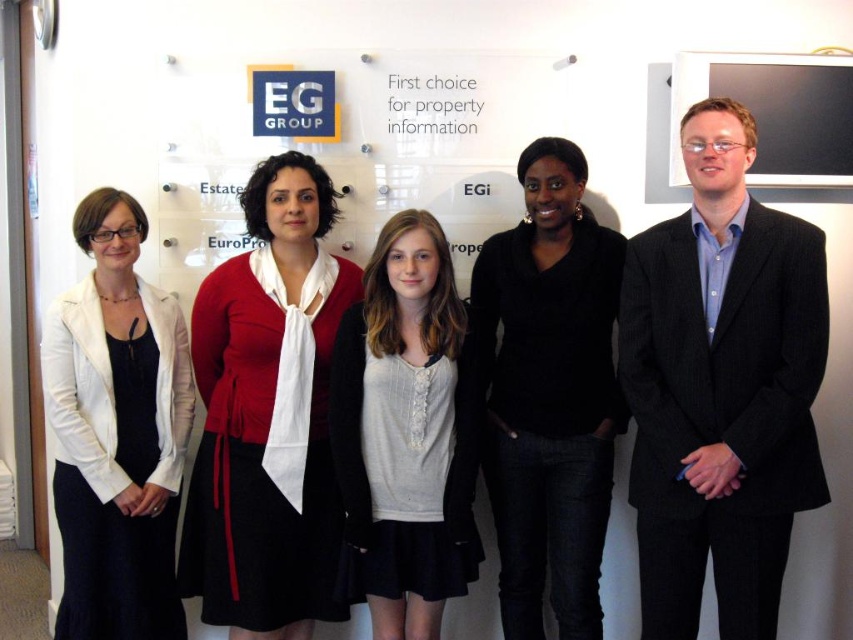
Question: Estimate the real-world distances between objects in this image. Which object is closer to the light gray knit sweater at center?

Choices:
 (A) black glossy monitor at upper right
 (B) matte red cardigan at center
 (C) black matte sweater at center
 (D) blue pinstripe suit at right

Answer: (B)

Question: Is white matte blazer at left wider than light gray knit sweater at center?

Choices:
 (A) no
 (B) yes

Answer: (A)

Question: Which object is farther from the camera taking this photo?

Choices:
 (A) white matte blazer at left
 (B) light gray knit sweater at center

Answer: (B)

Question: Which point is farther to the camera?

Choices:
 (A) (461, 548)
 (B) (727, 90)

Answer: (B)

Question: Does matte red cardigan at center have a larger size compared to white matte blazer at left?

Choices:
 (A) yes
 (B) no

Answer: (A)

Question: Is black matte sweater at center wider than white matte blazer at left?

Choices:
 (A) yes
 (B) no

Answer: (A)